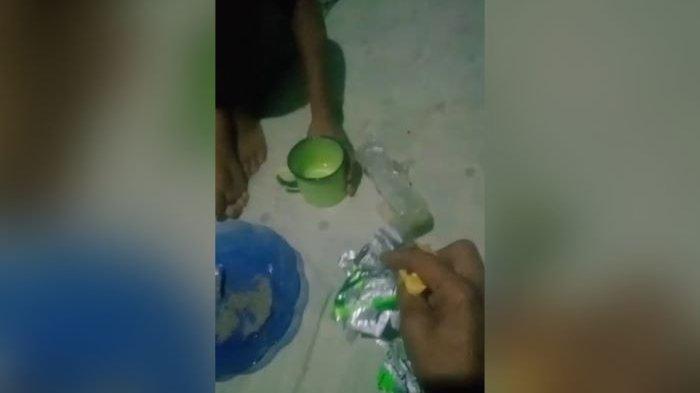
Locate an element on the screen. place to hold coffee cup is located at coordinates (280, 181).